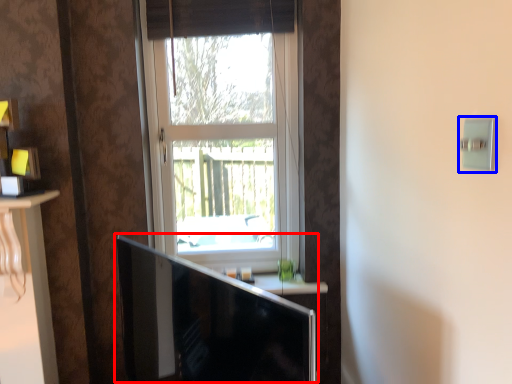
Question: Which point is further to the camera, computer monitor (highlighted by a red box) or light switch (highlighted by a blue box)?

Choices:
 (A) computer monitor
 (B) light switch

Answer: (B)